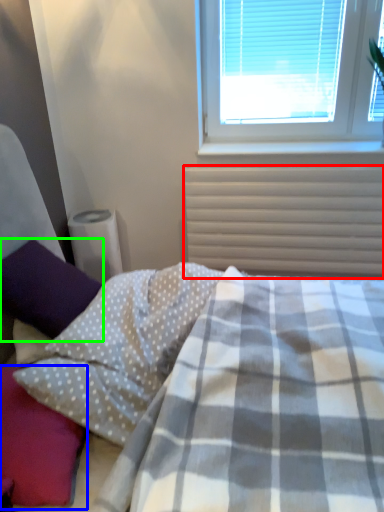
Question: Estimate the real-world distances between objects in this image. Which object is farther from radiator (highlighted by a red box), pillow (highlighted by a blue box) or pillow (highlighted by a green box)?

Choices:
 (A) pillow
 (B) pillow

Answer: (A)